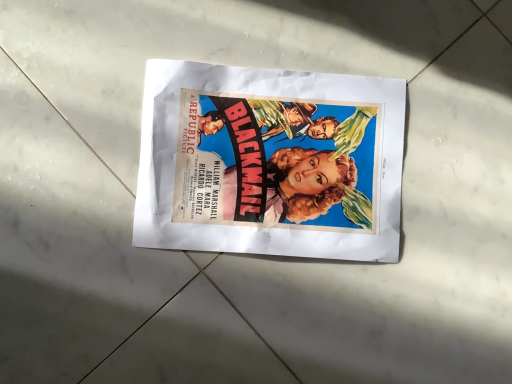
Where is `free space above matte paper poster at center (from a real-world perspective)`? The height and width of the screenshot is (384, 512). free space above matte paper poster at center (from a real-world perspective) is located at coordinates (273, 153).